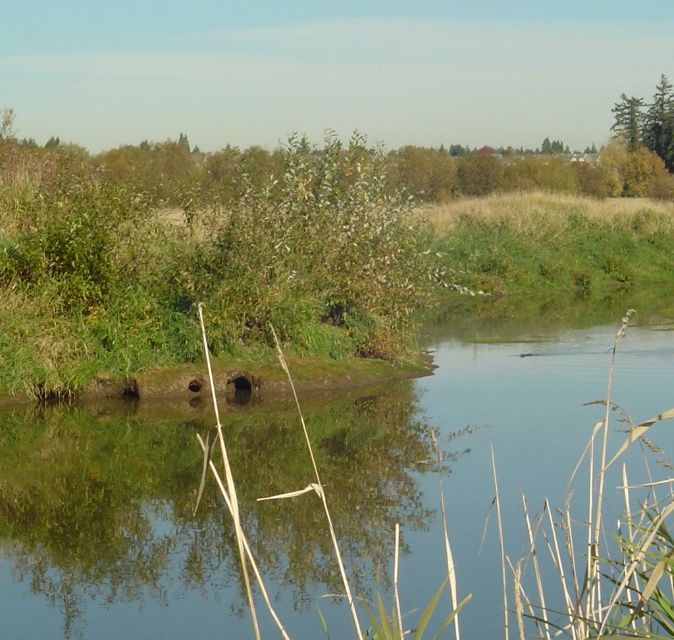
Question: Is the position of green grassy river at center more distant than that of green leafy tree at upper right?

Choices:
 (A) yes
 (B) no

Answer: (B)

Question: Does green grassy river at center have a larger size compared to green leafy tree at upper right?

Choices:
 (A) yes
 (B) no

Answer: (B)

Question: Which point appears closest to the camera in this image?

Choices:
 (A) coord(640,164)
 (B) coord(530,410)

Answer: (B)

Question: Among these objects, which one is farthest from the camera?

Choices:
 (A) green leafy tree at upper right
 (B) green grassy river at center

Answer: (A)

Question: Can you confirm if green grassy river at center is positioned above green leafy tree at upper right?

Choices:
 (A) no
 (B) yes

Answer: (A)